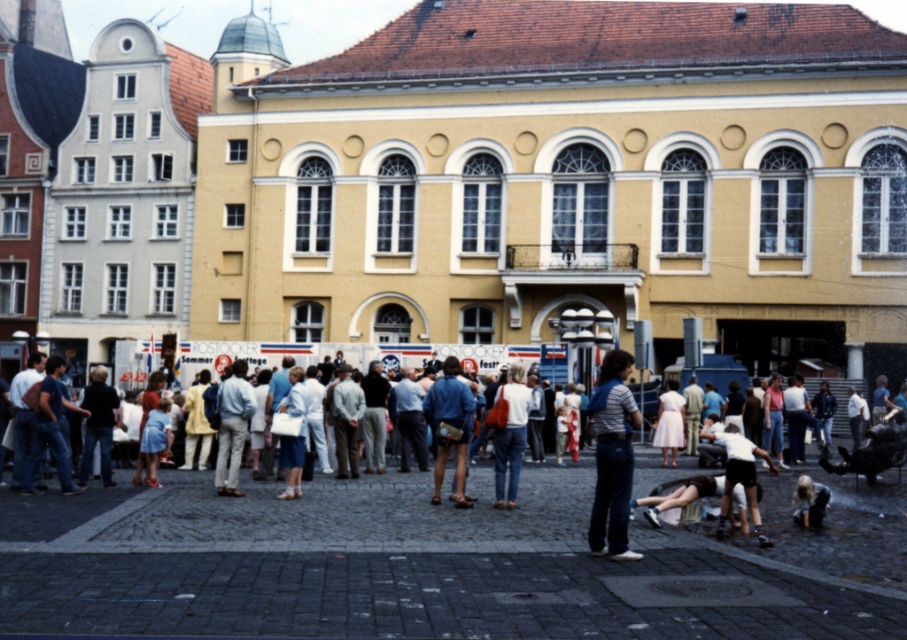
Based on the photo, who is more forward, (600,480) or (806,477)?

Point (600,480)

Does striped t-shirt at center have a lesser height compared to blonde hair person at lower right?

No.

Describe the element at coordinates (613, 458) in the screenshot. This screenshot has width=907, height=640. I see `striped t-shirt at center` at that location.

This screenshot has height=640, width=907. I want to click on striped t-shirt at center, so click(x=613, y=458).

What are the coordinates of `denim shorts at center` in the screenshot? It's located at (327, 515).

Between point (324, 484) and point (460, 417), which one is positioned in front?

Point (460, 417) is more forward.

The image size is (907, 640). What are the coordinates of `denim shorts at center` in the screenshot? It's located at (327, 515).

Is denim shorts at center taller than white cotton shirt at lower right?

Indeed, denim shorts at center has a greater height compared to white cotton shirt at lower right.

Consider the image. Who is shorter, denim shorts at center or white cotton shirt at lower right?

With less height is white cotton shirt at lower right.

Is point (398, 531) farther from viewer compared to point (734, 477)?

Yes.

Identify the location of denim shorts at center. This screenshot has height=640, width=907. (327, 515).